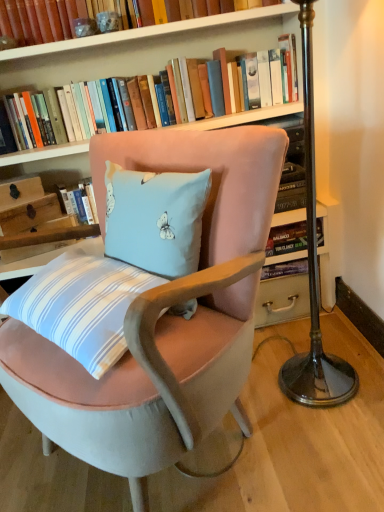
Question: From a real-world perspective, relative to hardcover books at upper center, which appears as the first book when ordered from the bottom, is matte wooden drawer at upper left, which appears as the 2th drawer when ordered from the bottom, vertically above or below?

Choices:
 (A) above
 (B) below

Answer: (B)

Question: Based on their sizes in the image, would you say matte wooden drawer at upper left, the first drawer from the top, is bigger or smaller than hardcover books at upper center, the second book when ordered from top to bottom?

Choices:
 (A) big
 (B) small

Answer: (B)

Question: Which object is positioned closest to the velvet pink chair at center?

Choices:
 (A) hardcover books at upper center, the second book when ordered from top to bottom
 (B) hardcover book at upper center, the second book ordered from the bottom
 (C) matte wooden drawer at upper left, the first drawer from the top
 (D) wooden drawer at left, which ranks as the 2th drawer in top-to-bottom order

Answer: (D)

Question: Considering the real-world distances, which object is closest to the hardcover book at upper center, which appears as the 1th book when viewed from the top?

Choices:
 (A) matte wooden drawer at upper left, which appears as the 2th drawer when ordered from the bottom
 (B) wooden drawer at left, the first drawer ordered from the bottom
 (C) velvet pink chair at center
 (D) hardcover books at upper center, the second book when ordered from top to bottom

Answer: (D)